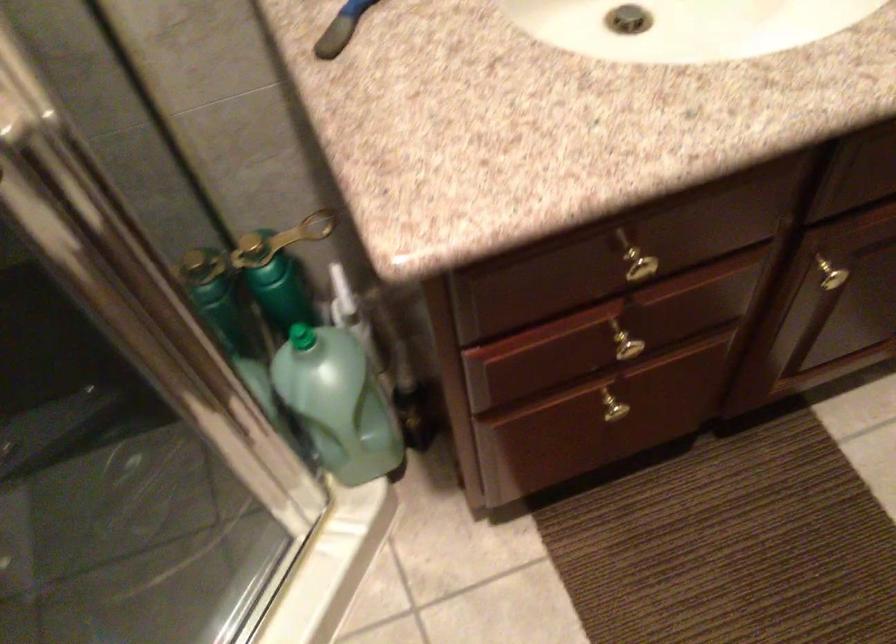
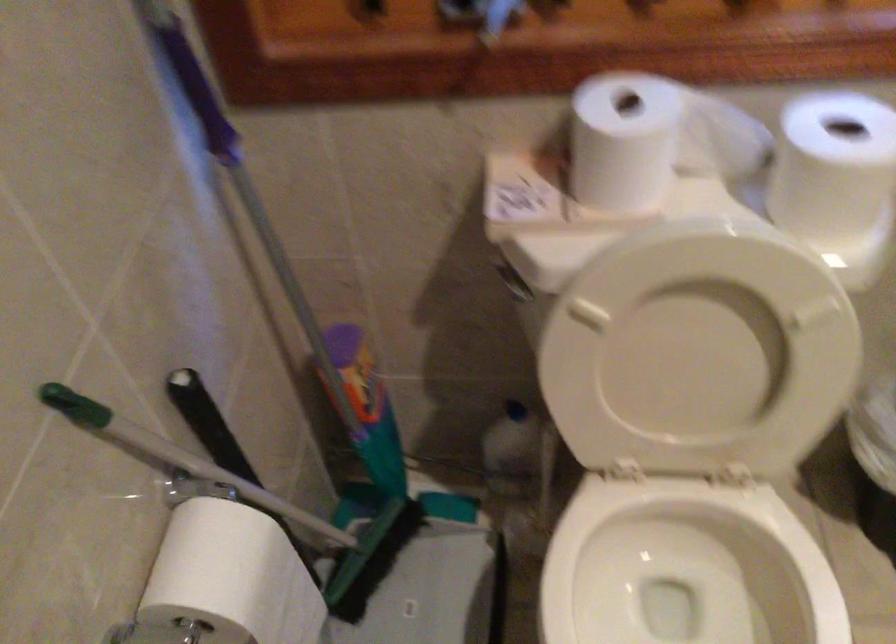
Based on the photo, the images are taken continuously from a first-person perspective. In which direction is your viewpoint rotating?

The rotation direction of the camera is left-down.